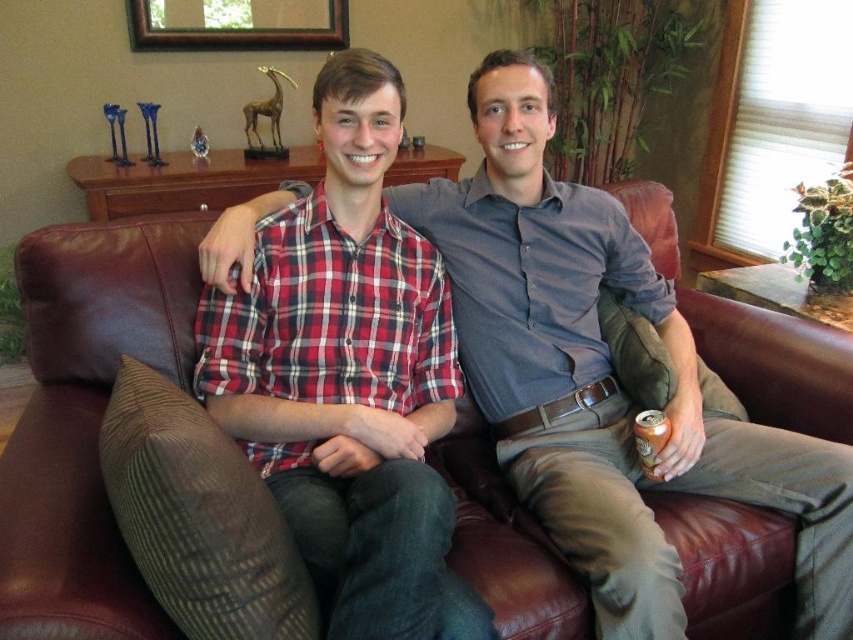
In the scene shown: You are a delivery person who needs to place a rectangular package that is 1.2 meters wide on the leather couch at center. Considering the size of the red plaid shirt at center, will the package fit on the couch?

The leather couch at center is wider than the red plaid shirt at center, but the description does not provide specific measurements for the couch or the shirt. Therefore, it is uncertain whether the 1.2 meter wide package will fit on the leather couch at center.

You are a delivery person who needs to place a small package between the red plaid shirt at center and the brown wooden picture frame at upper center. Can you fit the package in the space between them?

The red plaid shirt at center and brown wooden picture frame at upper center are 7.71 feet apart from each other, so the package can easily fit in the space between them since the distance is sufficient.